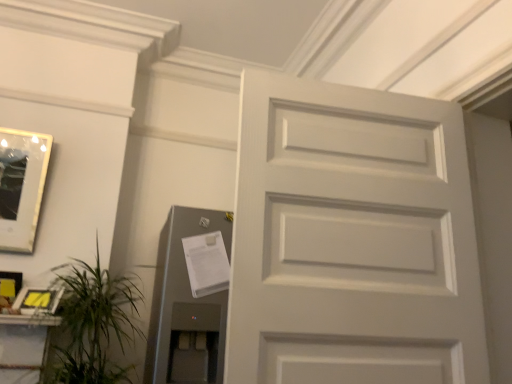
Question: From a real-world perspective, is matte black picture frame at lower left, the second picture frame positioned from the top, above or below white matte door at center?

Choices:
 (A) below
 (B) above

Answer: (A)

Question: Considering the relative positions of matte black picture frame at lower left, the second picture frame positioned from the top, and white matte door at center in the image provided, is matte black picture frame at lower left, the second picture frame positioned from the top, to the left or to the right of white matte door at center?

Choices:
 (A) right
 (B) left

Answer: (B)

Question: Which of these objects is positioned closest to the green leafy plant at lower left?

Choices:
 (A) white matte door at center
 (B) metallic gray elevator at lower left
 (C) matte silver picture frame at lower left, the 3th picture frame from the top
 (D) matte black picture frame at lower left, which appears as the second picture frame when ordered from the bottom
 (E) matte silver picture frame at upper left, arranged as the third picture frame when ordered from the bottom

Answer: (C)

Question: Considering the real-world distances, which object is farthest from the matte silver picture frame at lower left, positioned as the first picture frame in bottom-to-top order?

Choices:
 (A) matte silver picture frame at upper left, arranged as the third picture frame when ordered from the bottom
 (B) metallic gray elevator at lower left
 (C) green leafy plant at lower left
 (D) white matte door at center
 (E) matte black picture frame at lower left, which appears as the second picture frame when ordered from the bottom

Answer: (D)